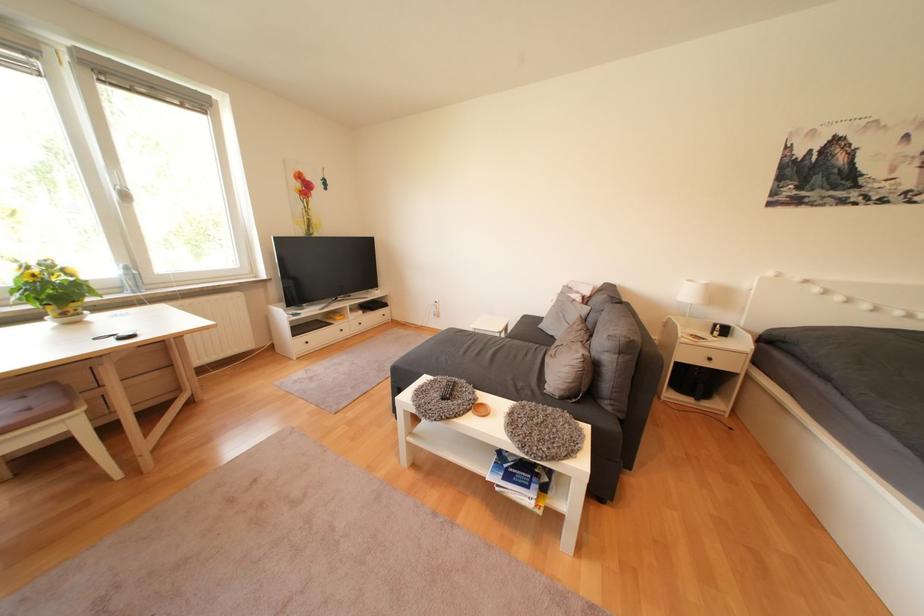
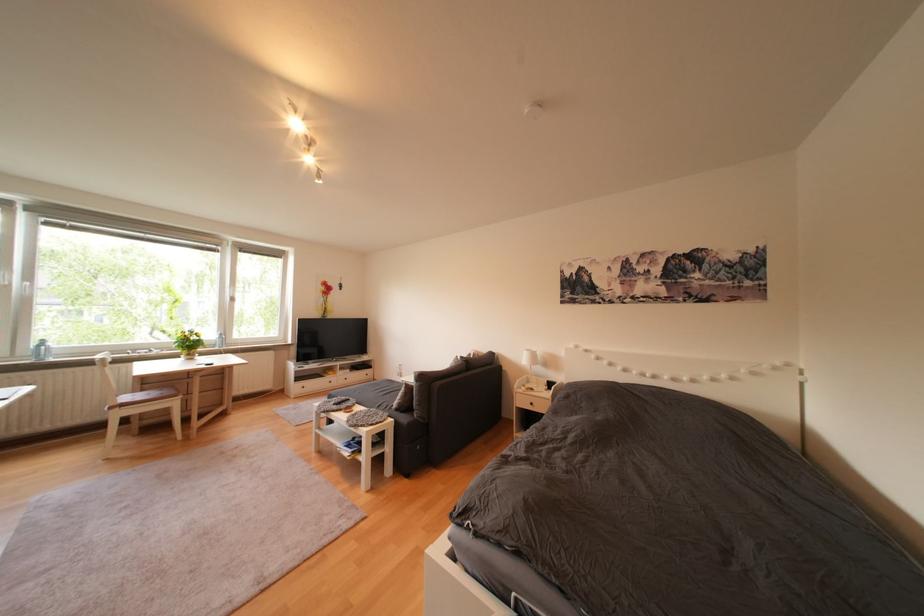
Based on the photo, in a continuous first-person perspective shot, in which direction is the camera moving?

The cameraman walked toward right, backward.